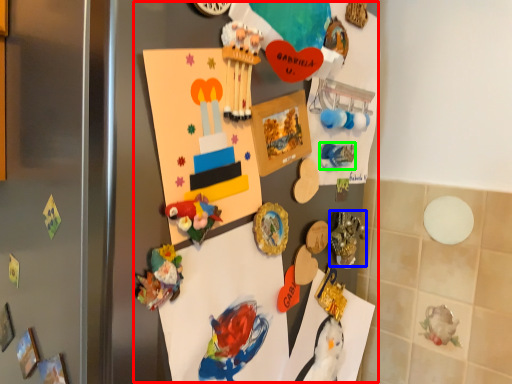
Question: Considering the real-world distances, which object is closest to collection (highlighted by a red box)? art (highlighted by a blue box) or art (highlighted by a green box).

Choices:
 (A) art
 (B) art

Answer: (A)